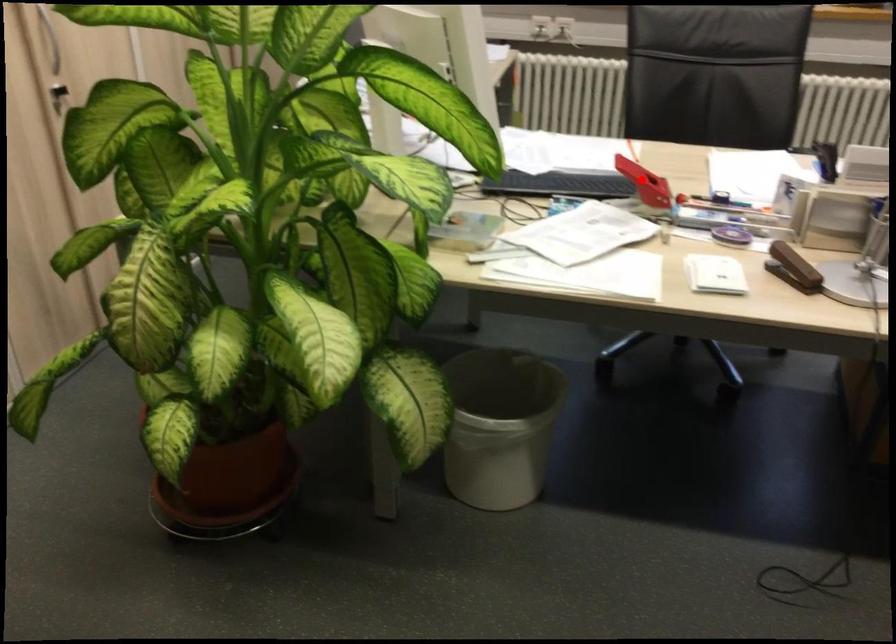
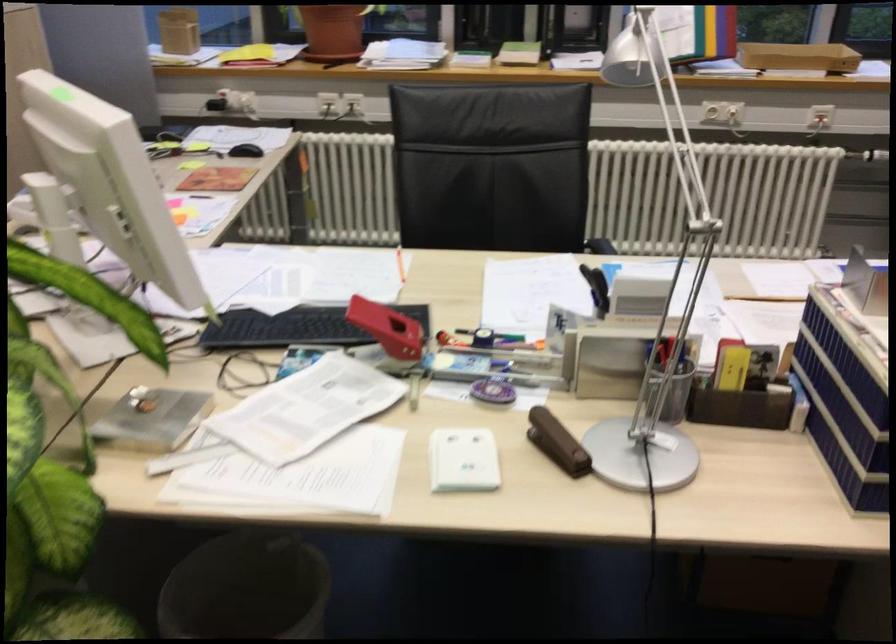
Find the pixel in the second image that matches the highlighted location in the first image.

(388, 328)